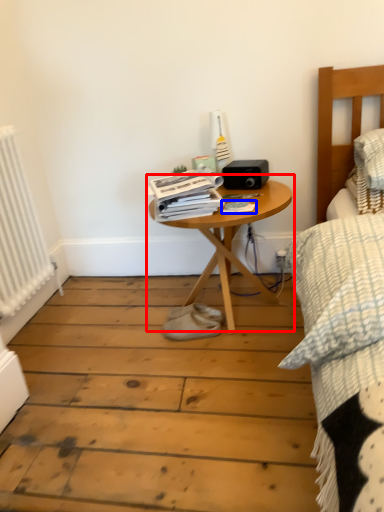
Question: Which object is further to the camera taking this photo, table (highlighted by a red box) or magazine (highlighted by a blue box)?

Choices:
 (A) table
 (B) magazine

Answer: (B)